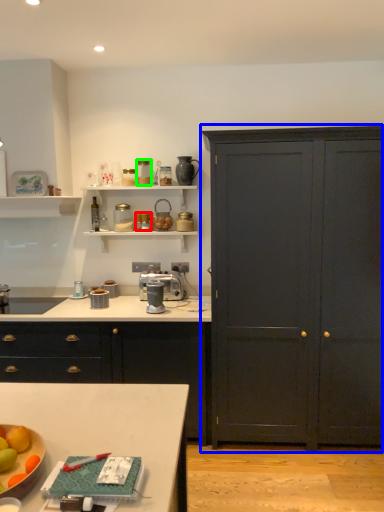
Question: Based on their relative distances, which object is nearer to appliance (highlighted by a red box)? Choose from cupboard (highlighted by a blue box) and appliance (highlighted by a green box).

Choices:
 (A) cupboard
 (B) appliance

Answer: (B)